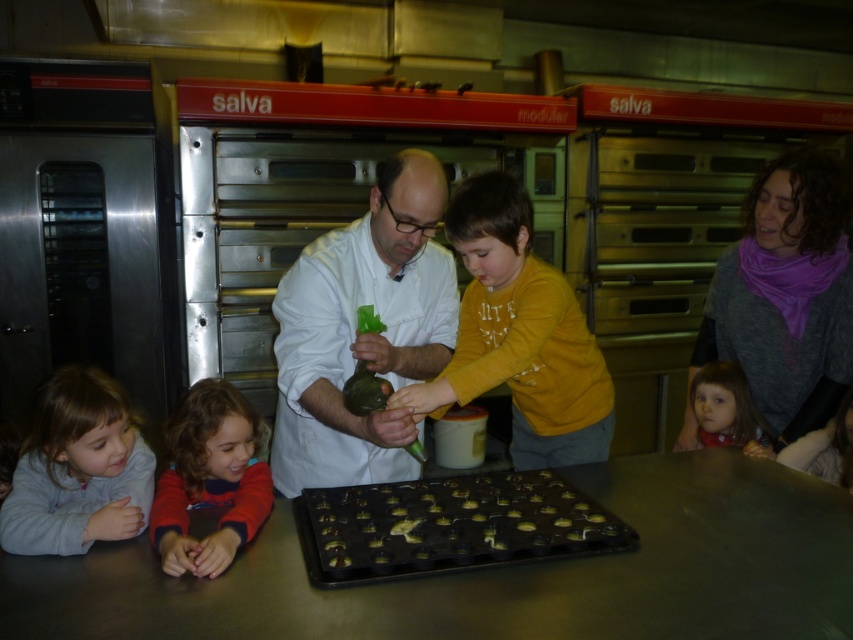
Question: Which point appears farthest from the camera in this image?

Choices:
 (A) (22, 536)
 (B) (343, 243)
 (C) (339, 566)

Answer: (B)

Question: Which point is closer to the camera?

Choices:
 (A) (550, 317)
 (B) (167, 470)
 (C) (514, 500)

Answer: (C)

Question: Which object is farther from the camera taking this photo?

Choices:
 (A) yellow matte shirt at center
 (B) white matte chef coat at center
 (C) golden chocolate tray at center
 (D) curly-haired child at lower left

Answer: (A)

Question: Is yellow matte shirt at center smaller than matte pink scarf at lower right?

Choices:
 (A) yes
 (B) no

Answer: (B)

Question: Can you confirm if white matte chef coat at center is positioned to the right of gray fleece jacket at lower left?

Choices:
 (A) yes
 (B) no

Answer: (A)

Question: Can you confirm if purple scarf at upper right is smaller than yellow matte shirt at center?

Choices:
 (A) yes
 (B) no

Answer: (A)